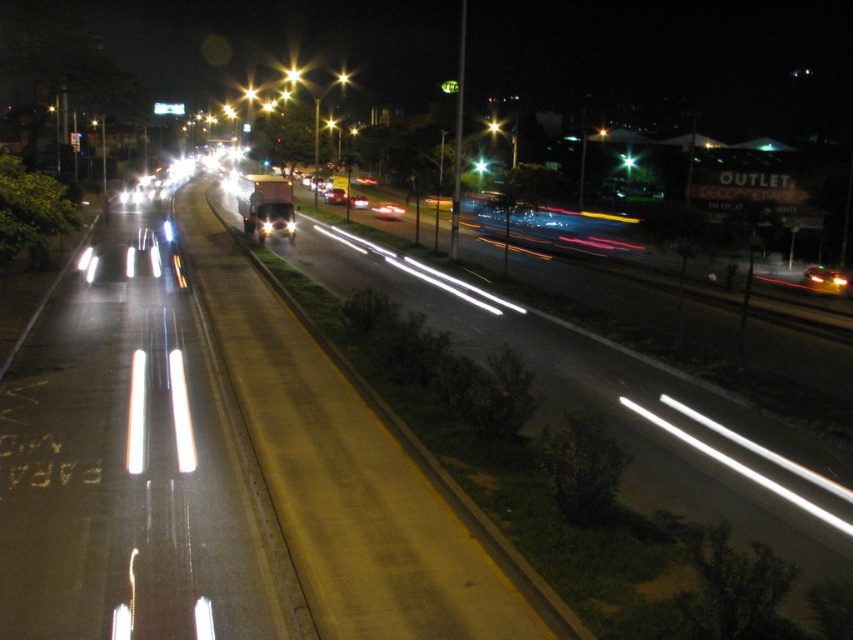
Does matte black car at center have a greater width compared to bright metallic streetlight at center?

No, matte black car at center is not wider than bright metallic streetlight at center.

Is matte black car at center in front of bright metallic streetlight at center?

Yes, it is.

The image size is (853, 640). Describe the element at coordinates (358, 202) in the screenshot. I see `matte black car at center` at that location.

You are a GUI agent. You are given a task and a screenshot of the screen. Output one action in this format:
    pyautogui.click(x=<x>, y=<y>)
    Task: Click on the matte black car at center
    The height and width of the screenshot is (640, 853).
    Given the screenshot: What is the action you would take?
    pyautogui.click(x=358, y=202)

Is point (352, 204) positioned in front of point (340, 76)?

Yes, point (352, 204) is in front of point (340, 76).

Does matte black car at center appear on the left side of bright yellow streetlight at upper center?

Incorrect, matte black car at center is not on the left side of bright yellow streetlight at upper center.

Between point (352, 195) and point (340, 72), which one is positioned in front?

Point (352, 195) is more forward.

Where is `matte black car at center`? The image size is (853, 640). matte black car at center is located at coordinates (358, 202).

Does shiny silver car at center appear on the left side of shiny silver sedan at center?

In fact, shiny silver car at center is to the right of shiny silver sedan at center.

Is point (396, 205) more distant than point (329, 189)?

No, it is not.

Where is `shiny silver car at center`? This screenshot has width=853, height=640. shiny silver car at center is located at coordinates (387, 211).